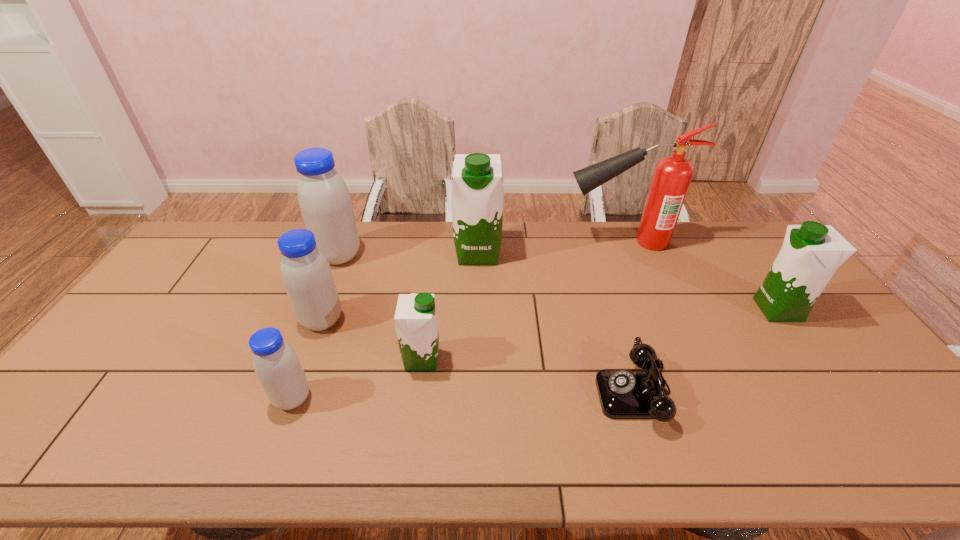
At what (x,y) coordinates should I click in order to perform the action: click on the smallest blue soya milk. Please return your answer as a coordinate pair (x, y). Image resolution: width=960 pixels, height=540 pixels. Looking at the image, I should click on (277, 366).

Image resolution: width=960 pixels, height=540 pixels. What are the coordinates of `black telephone` in the screenshot? It's located at (624, 393).

Where is `telephone`? This screenshot has width=960, height=540. telephone is located at coordinates (624, 393).

I want to click on free space located at the nozzle of the red fire extinguisher, so click(x=543, y=241).

The width and height of the screenshot is (960, 540). Find the location of `vacant space located at the nozzle of the red fire extinguisher`. vacant space located at the nozzle of the red fire extinguisher is located at coordinates (536, 241).

This screenshot has height=540, width=960. I want to click on vacant area situated 0.280m at the nozzle of the red fire extinguisher, so click(485, 241).

Locate an element on the screen. The width and height of the screenshot is (960, 540). free space located on the back of the biggest blue soya milk is located at coordinates [351, 224].

I want to click on free space located on the front-facing side of the farthest green soya milk, so click(477, 340).

At what (x,y) coordinates should I click in order to perform the action: click on free point located on the front-facing side of the rightmost soya milk. Please return your answer as a coordinate pair (x, y). Image resolution: width=960 pixels, height=540 pixels. Looking at the image, I should click on (709, 310).

Locate an element on the screen. vacant area situated 0.140m on the front-facing side of the rightmost soya milk is located at coordinates (709, 310).